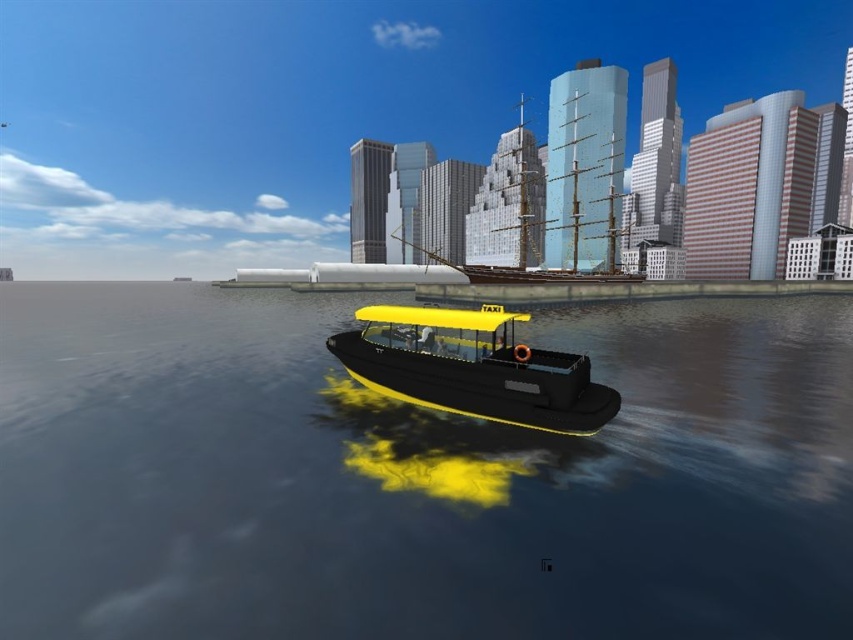
You are a photographer planning to capture the reflection of the yellow matte taxi boat at center in the glossy water at boat center. Based on the scene description, will the reflection of the boat be fully visible in the water?

The glossy water at boat center has a greater height compared to yellow matte taxi boat at center, so the reflection of the yellow matte taxi boat at center will be fully visible in the glossy water at boat center.

You are a drone operator trying to capture a photo of the yellow and black boat in the center of the image. The boat has a lifebuoy on its side. To ensure the glossy water at boat center is clearly visible in the photo, where should you position the drone relative to the boat?

The glossy water at boat center is located at point (415, 476), so the drone should be positioned to capture that coordinate to ensure the glossy water at boat center is clearly visible.

You are standing at the edge of the waterfront and see the yellow and black boat in the center. There is a point marked at coordinates [415,476]. What does this point represent?

The point at coordinates [415,476] marks the glossy water at the boat center.